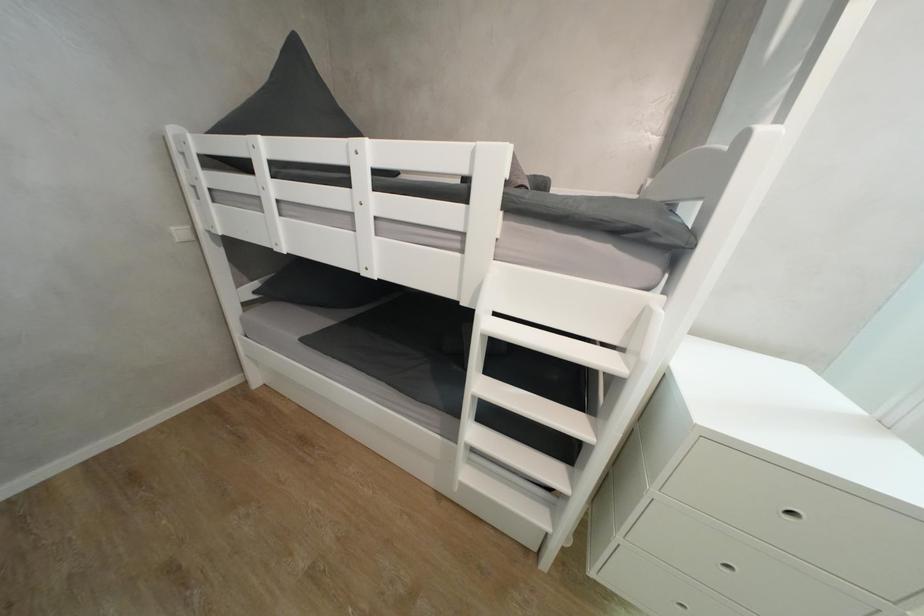
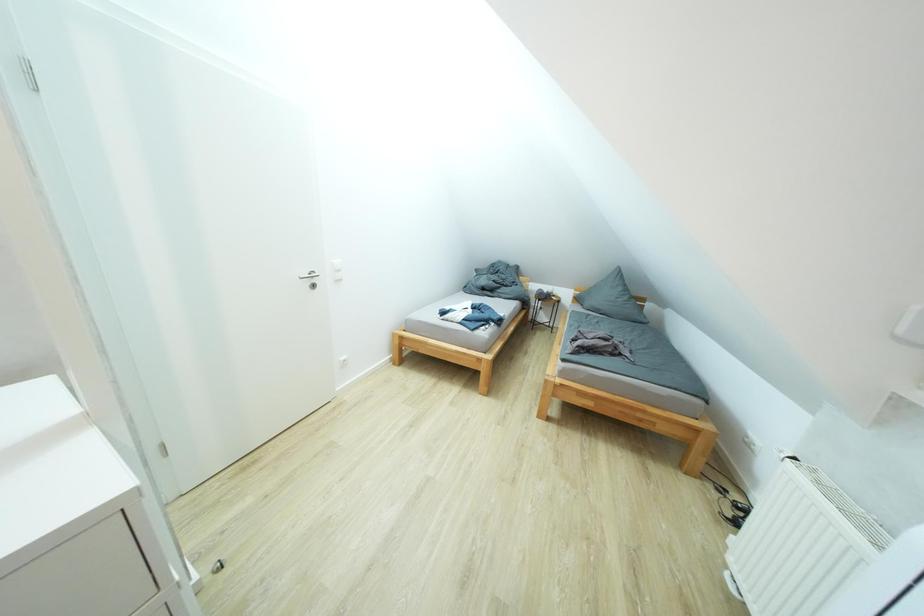
Consider the image. The first image is from the beginning of the video and the second image is from the end. How did the camera likely rotate when shooting the video?

The rotation direction of the camera is right-down.